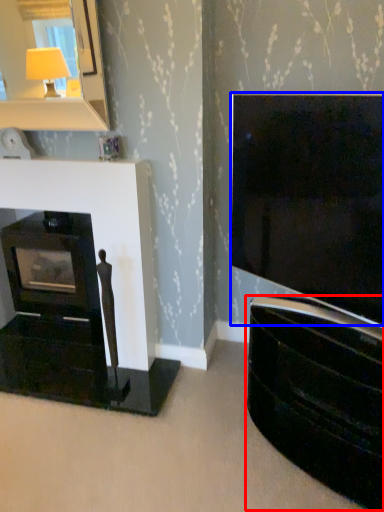
Question: Which point is further to the camera, tv cabinet (highlighted by a red box) or television (highlighted by a blue box)?

Choices:
 (A) tv cabinet
 (B) television

Answer: (A)